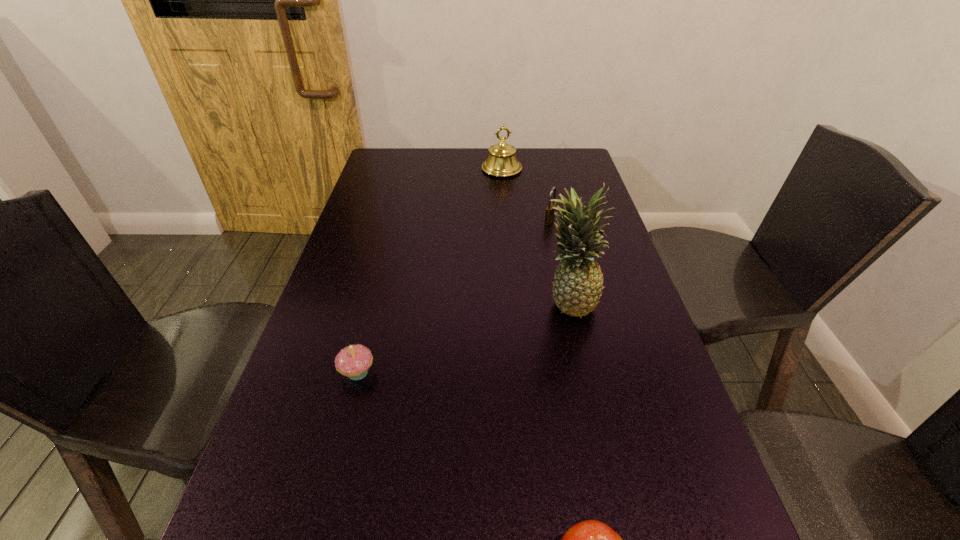
Identify the location of empty location between the second farthest object and the second tallest object. (526, 195).

Image resolution: width=960 pixels, height=540 pixels. I want to click on free space that is in between the padlock and the fourth farthest object, so click(x=453, y=296).

Identify the location of vacant space that is in between the padlock and the farthest object. This screenshot has height=540, width=960. (526, 195).

Find the location of `unoccupied area between the pineapple and the farthest object`. unoccupied area between the pineapple and the farthest object is located at coordinates pos(535,235).

Identify the location of free space that is in between the pineapple and the padlock. (559, 261).

Choose which object is the nearest neighbor to the nearest object. Please provide its 2D coordinates. Your answer should be formatted as a tuple, i.e. [(x, y)], where the tuple contains the x and y coordinates of a point satisfying the conditions above.

[(353, 361)]

Find the location of a particular element. Image resolution: width=960 pixels, height=540 pixels. object that is the second nearest to the padlock is located at coordinates tap(577, 287).